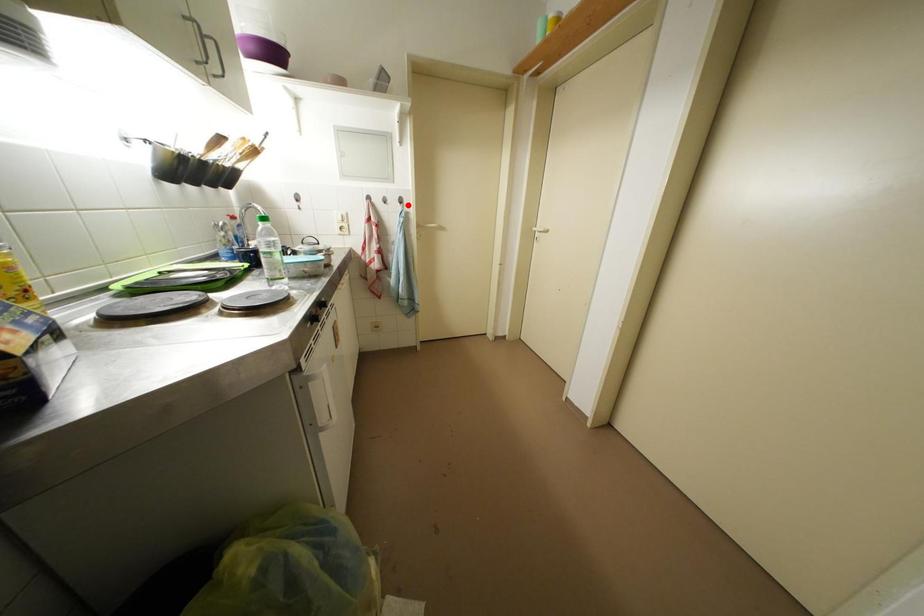
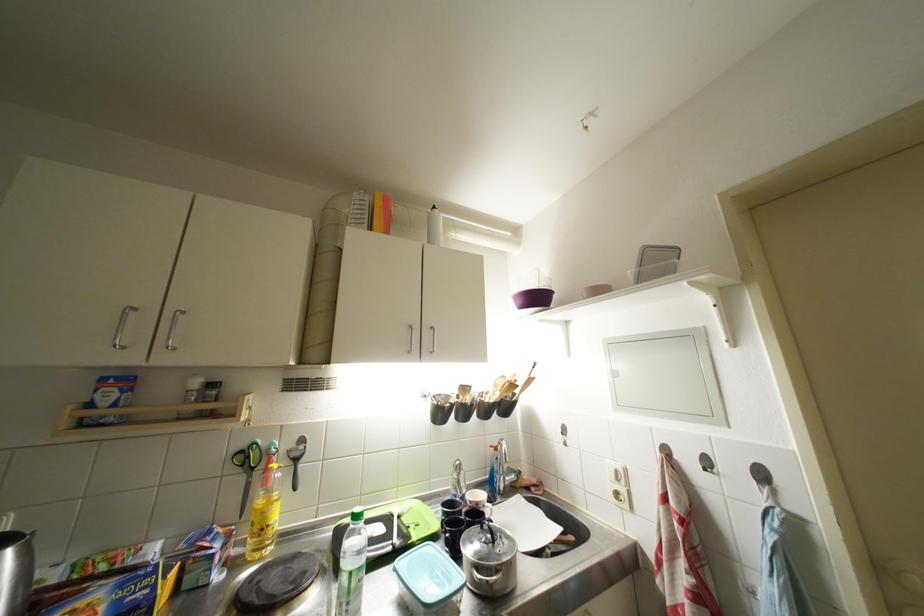
Question: I am providing you with two images of the same scene from different viewpoints. Given a red point in image1, look at the same physical point in image2. Is it:

Choices:
 (A) Closer to the viewpoint
 (B) Farther from the viewpoint

Answer: (B)